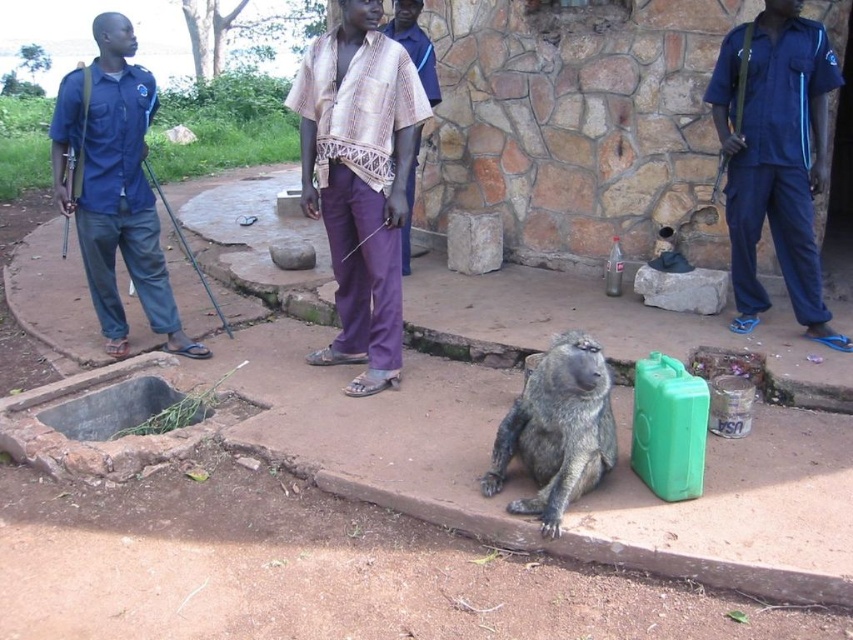
You are a photographer trying to capture a group photo of the two people wearing blue uniforms in the scene. You want to arrange them so that both are visible in the frame. Based on their positions, which side should the person in the blue uniform at left stand relative to the person in the blue uniform at right to ensure they are both in the photo?

The blue uniform at right is to the right of the blue uniform at left, so to ensure both are visible in the photo, the person in the blue uniform at left should stand to the left of the person in the blue uniform at right.

You are a delivery person who needs to place a package between the blue uniform at right and the blue uniform at left. The package requires a space of 10 feet to fit. Can you place the package between them?

The blue uniform at right and blue uniform at left are 10.11 feet apart from each other, so yes, the package can be placed between them as the distance is sufficient.

You are standing at the origin point of the coordinate system in the image. You want to walk towards the gray furry monkey at center. Which direction should you move in the image?

The gray furry monkey at center is located at coordinate point 0.672 on the x axis and 0.654 on the y axis. Since you are at the origin point, you should move towards the positive x and positive y direction to reach the gray furry monkey at center.